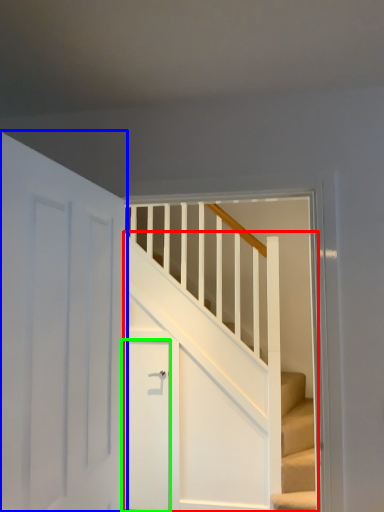
Question: Based on their relative distances, which object is nearer to stairs (highlighted by a red box)? Choose from door (highlighted by a blue box) and door (highlighted by a green box).

Choices:
 (A) door
 (B) door

Answer: (B)